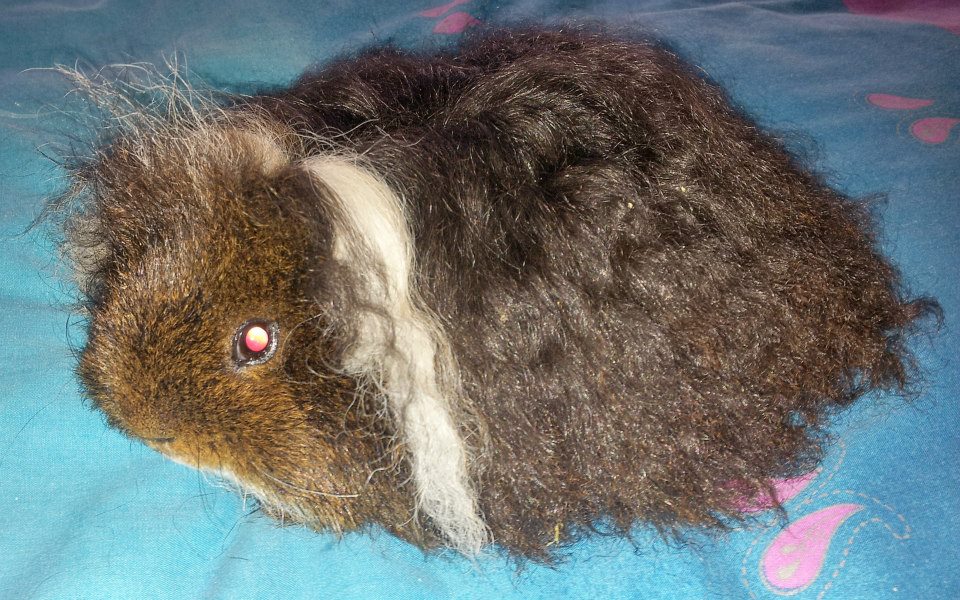
Locate an element on the screen. This screenshot has width=960, height=600. light blue blanket is located at coordinates (811, 66).